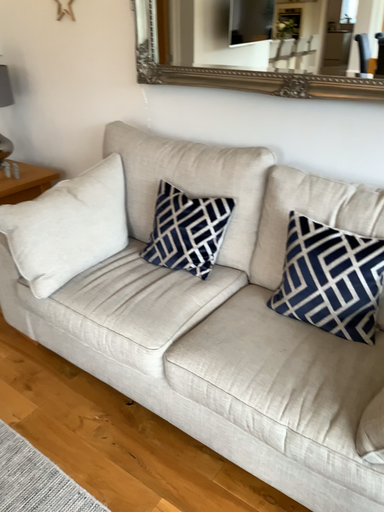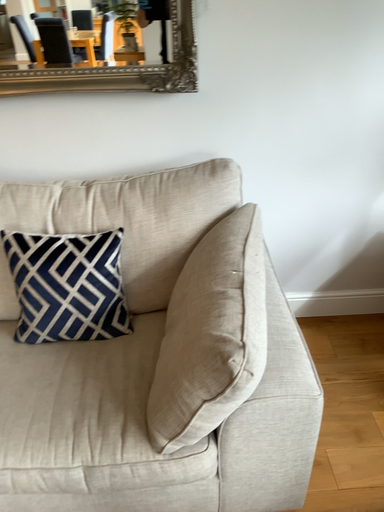
Question: How did the camera likely rotate when shooting the video?

Choices:
 (A) rotated right
 (B) rotated left

Answer: (A)